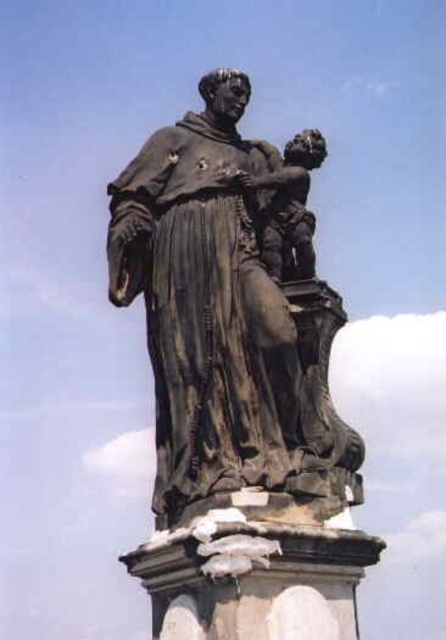
You are an art conservator assessing the statues. Given that the bronze statue at center is larger than the bronze statue child at right, which one would require more material for restoration if both need to be coated with a protective layer? Explain your reasoning.

The bronze statue at center would require more material for restoration because it is larger in size than the bronze statue child at right, necessitating a greater amount of protective coating to cover its surface area.

You are an art conservator examining the bronze statue at center and the bronze statue child at right. You notice that rainwater might be causing damage. Which statue should you prioritize inspecting first for water damage based on their positions?

The bronze statue at center should be prioritized for inspection because it is positioned under the bronze statue child at right, meaning it is more exposed to dripping water from above.